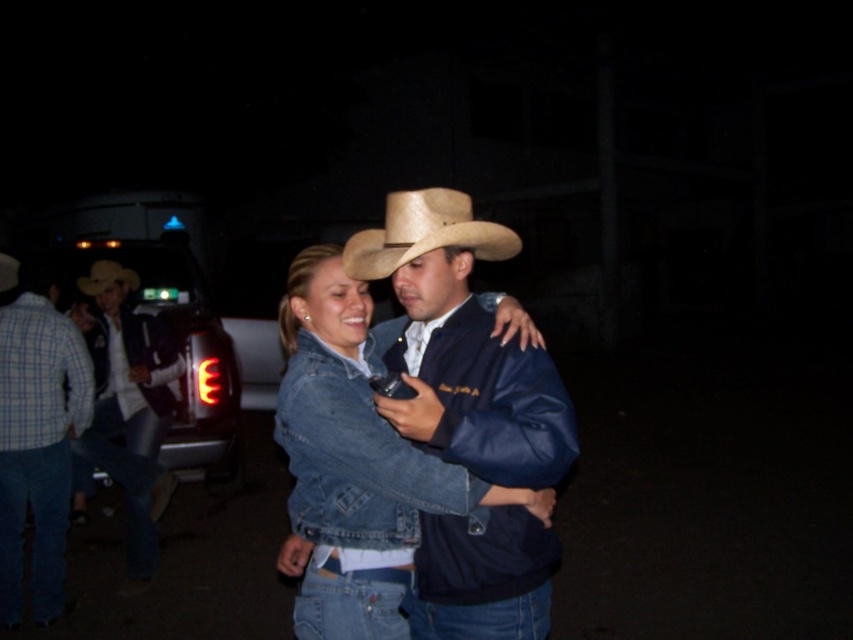
You are a photographer trying to capture a photo of the two people in the foreground. You want to focus on the point closer to the camera between the two points marked as point (480,611) and point (440,221). Which point should you focus on?

You should focus on point (480,611) because it is closer to the camera than point (440,221) according to the description.

You are trying to determine the clothing items worn by the two people in the image. Given that the plaid cotton shirt at left is thinner than the brushed metal cowboy hat at left, which clothing item is more visible in terms of thickness?

The plaid cotton shirt at left is thinner than the brushed metal cowboy hat at left, so the brushed metal cowboy hat at left is more visible in terms of thickness.